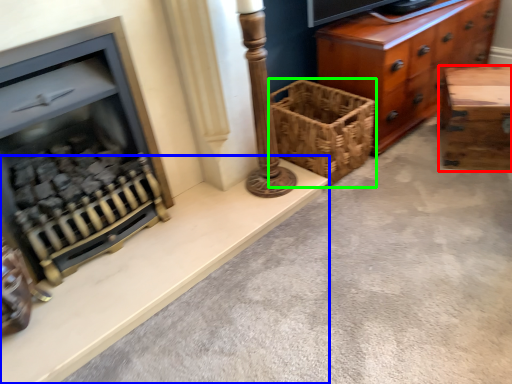
Question: Which object is the farthest from table (highlighted by a red box)? Choose among these: ledge (highlighted by a blue box) or basket (highlighted by a green box).

Choices:
 (A) ledge
 (B) basket

Answer: (A)